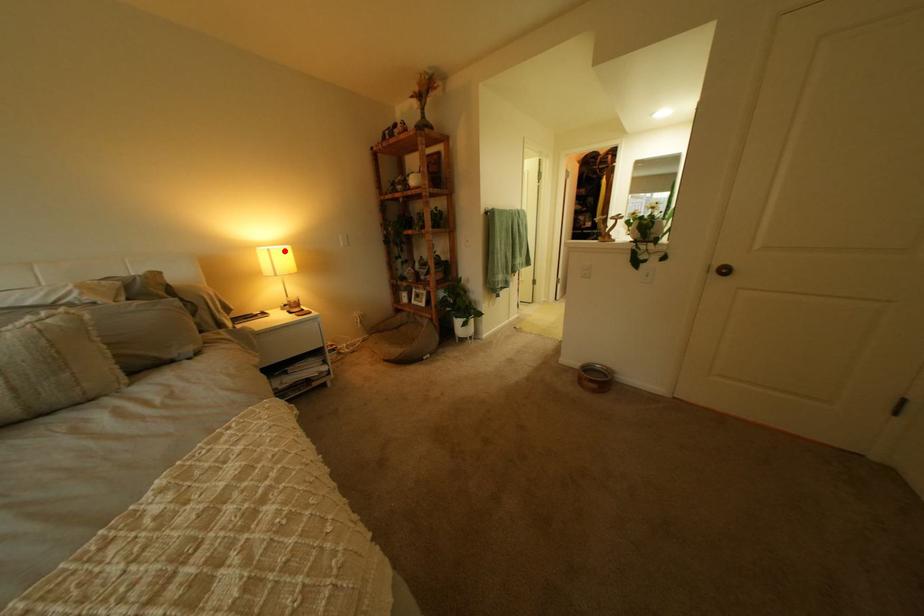
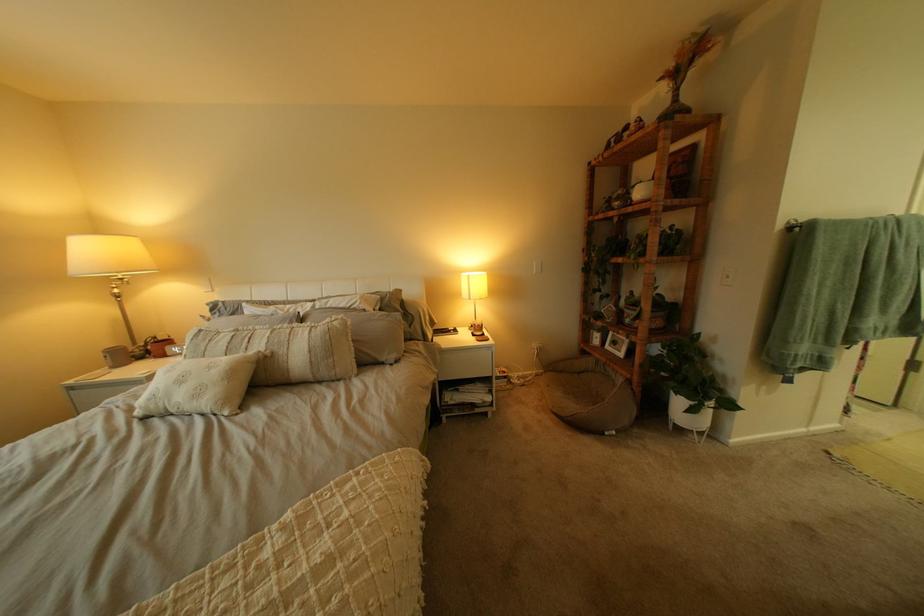
Find the pixel in the second image that matches the highlighted location in the first image.

(483, 277)